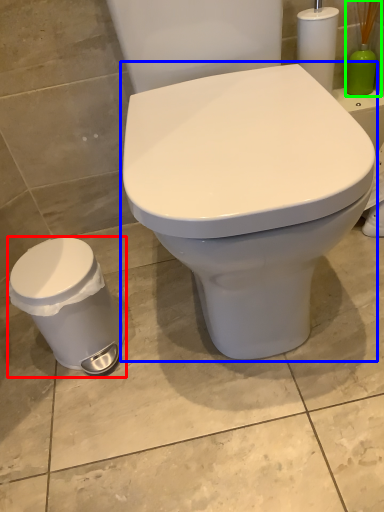
Question: Based on their relative distances, which object is nearer to porcelain (highlighted by a red box)? Choose from toilet (highlighted by a blue box) and brush (highlighted by a green box).

Choices:
 (A) toilet
 (B) brush

Answer: (A)